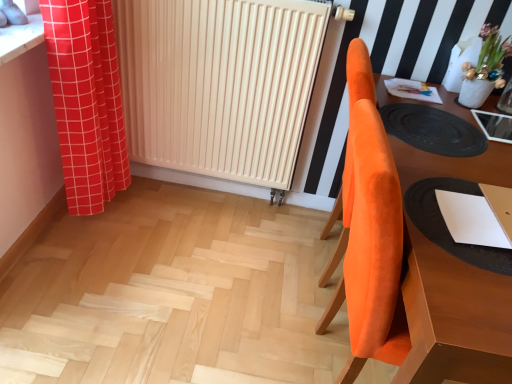
Question: Is white matte radiator at center taller or shorter than red checkered curtain at left?

Choices:
 (A) short
 (B) tall

Answer: (B)

Question: Based on their positions, is white matte radiator at center located to the left or right of red checkered curtain at left?

Choices:
 (A) left
 (B) right

Answer: (B)

Question: Based on their relative distances, which object is nearer to the white paper at right?

Choices:
 (A) natural wood stairs at center
 (B) black rubber mat at right
 (C) white matte radiator at center
 (D) orange velvet chair at right
 (E) red checkered curtain at left

Answer: (D)

Question: Estimate the real-world distances between objects in this image. Which object is closer to the white paper at right?

Choices:
 (A) red checkered curtain at left
 (B) black rubber mat at right
 (C) white matte radiator at center
 (D) natural wood stairs at center
 (E) orange velvet chair at right

Answer: (E)